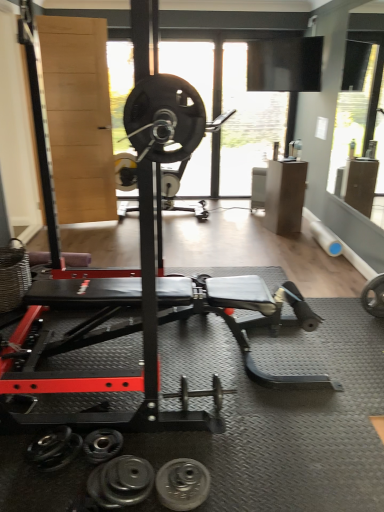
Question: Does point (236, 44) appear closer or farther from the camera than point (105, 481)?

Choices:
 (A) closer
 (B) farther

Answer: (B)

Question: Based on their sizes in the image, would you say transparent glass window screen at upper center is bigger or smaller than black rubber dumbbell at lower center, positioned as the second dumbbell in left-to-right order?

Choices:
 (A) big
 (B) small

Answer: (A)

Question: Which is nearer to the black rubber dumbbell at lower center, which is the second dumbbell in back-to-front order?

Choices:
 (A) transparent glass window screen at upper center
 (B) black rubber weight plate at lower center
 (C) silver metallic dumbbell at center, which is the first dumbbell in right-to-left order
 (D) black rubber dumbbell at lower center, which is the third dumbbell from back to front

Answer: (D)

Question: Based on their relative distances, which object is nearer to the black rubber dumbbell at lower center, positioned as the 2th dumbbell in front-to-back order?

Choices:
 (A) black rubber dumbbell at lower center, the 1th dumbbell from the front
 (B) silver metallic dumbbell at center, the 1th dumbbell positioned from the top
 (C) black rubber weight plate at lower center
 (D) transparent glass window screen at upper center

Answer: (A)